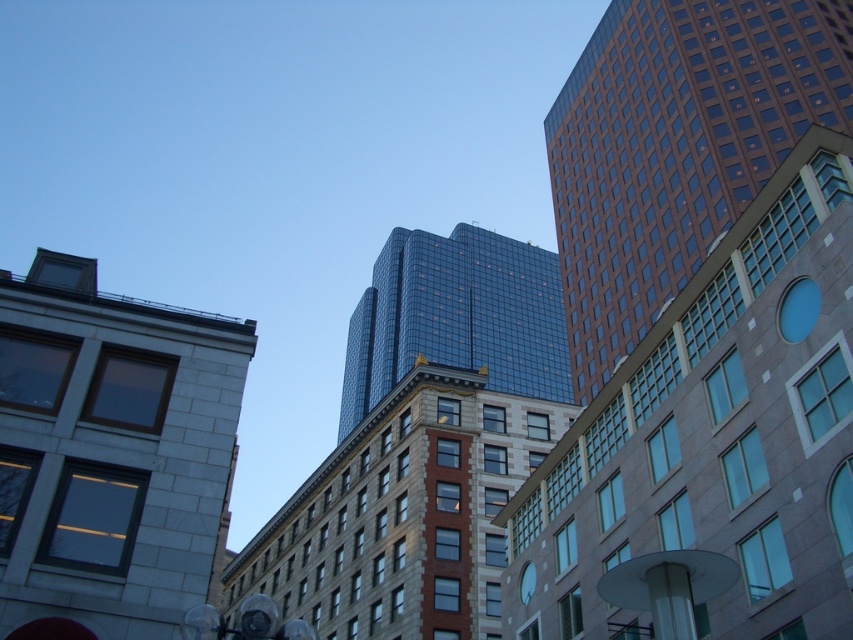
You are a city planner reviewing this area. You need to install a new streetlight between the brown glassy skyscraper at right and the blue glass clock at upper center. Based on their positions, where should the streetlight be placed?

The streetlight should be placed to the left of the brown glassy skyscraper at right since it is to the right of the blue glass clock at upper center.

You are standing at the camera position and want to take a photo of the gray stone building at upper left. Considering the distance, will you need to use a zoom lens to capture the entire building in the photo?

The gray stone building at upper left is 69.04 feet away from the camera. Since this distance is relatively far, using a zoom lens would help ensure the entire building fits within the camera frame.

From the picture: You are standing in the cityscape and want to determine which of the two points, point (654, 157) or point (527, 602), is closer to you. Based on the image, which point is nearer?

Point (654, 157) is closer to you because it is further to the viewer than point (527, 602).